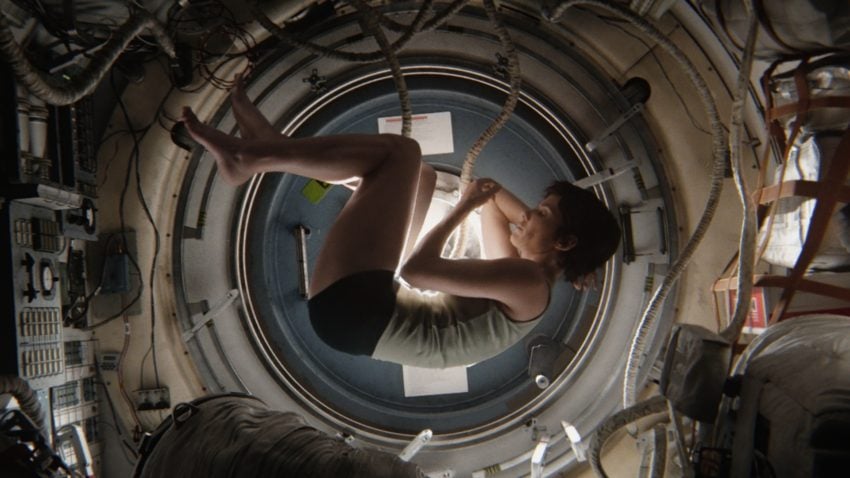
You are a GUI agent. You are given a task and a screenshot of the screen. Output one action in this format:
    pyautogui.click(x=<x>, y=<y>)
    Task: Click on the metal grey door
    
    Given the screenshot: What is the action you would take?
    pyautogui.click(x=460, y=383)